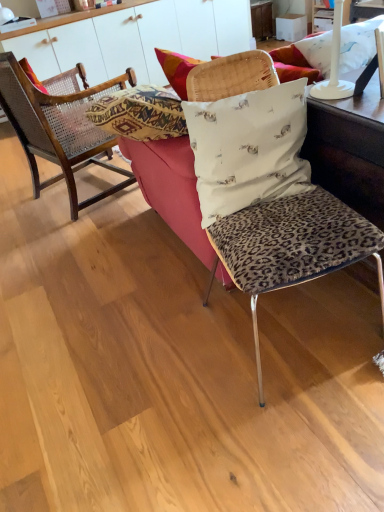
Locate an element on the screen. leopard print fabric couch at center is located at coordinates (347, 161).

This screenshot has height=512, width=384. What do you see at coordinates (139, 39) in the screenshot? I see `white glossy cabinet at upper center` at bounding box center [139, 39].

Locate an element on the screen. The width and height of the screenshot is (384, 512). wooden cane chair at left, positioned as the second chair in right-to-left order is located at coordinates (58, 129).

Looking at their sizes, would you say leopard print fabric couch at center is wider or thinner than leopard print cushion at center, acting as the 2th chair starting from the back?

leopard print fabric couch at center is wider than leopard print cushion at center, acting as the 2th chair starting from the back.

Based on their sizes in the image, would you say leopard print fabric couch at center is bigger or smaller than leopard print cushion at center, the second chair from the left?

Considering their sizes, leopard print fabric couch at center takes up more space than leopard print cushion at center, the second chair from the left.

Based on the photo, which of these two, leopard print fabric couch at center or leopard print cushion at center, acting as the 2th chair starting from the back, stands shorter?

With less height is leopard print fabric couch at center.

Does leopard print fabric couch at center lie behind leopard print cushion at center, the second chair from the left?

Yes, it is.

Would you say wooden cane chair at left, the first chair viewed from the back, is outside leopard print cushion at center, the 1th chair viewed from the right?

Yes.

Does point (103, 164) come in front of point (222, 248)?

No, (103, 164) is further to viewer.

Is wooden cane chair at left, the 1th chair in the left-to-right sequence, to the right of leopard print cushion at center, the second chair from the left, from the viewer's perspective?

Incorrect, wooden cane chair at left, the 1th chair in the left-to-right sequence, is not on the right side of leopard print cushion at center, the second chair from the left.

Is leopard print fabric couch at center oriented towards woven cane pillow at left, which is the 1th pillow in left-to-right order?

No, leopard print fabric couch at center does not turn towards woven cane pillow at left, which is the 1th pillow in left-to-right order.

Considering the relative sizes of leopard print fabric couch at center and woven cane pillow at left, which is the 1th pillow in left-to-right order, in the image provided, is leopard print fabric couch at center taller than woven cane pillow at left, which is the 1th pillow in left-to-right order,?

Correct, leopard print fabric couch at center is much taller as woven cane pillow at left, which is the 1th pillow in left-to-right order.

Is leopard print fabric couch at center bigger or smaller than woven cane pillow at left, the 2th pillow in the bottom-to-top sequence?

Considering their sizes, leopard print fabric couch at center takes up more space than woven cane pillow at left, the 2th pillow in the bottom-to-top sequence.

Does leopard print fabric couch at center appear on the right side of woven cane pillow at left, which is the first pillow in back-to-front order?

Yes.

Between white fabric pillow with small animal prints at center, the 2th pillow positioned from the back, and woven cane pillow at left, the 2th pillow in the bottom-to-top sequence, which one appears on the right side from the viewer's perspective?

white fabric pillow with small animal prints at center, the 2th pillow positioned from the back.

Is white fabric pillow with small animal prints at center, the first pillow when ordered from right to left, inside the boundaries of woven cane pillow at left, positioned as the 2th pillow in front-to-back order, or outside?

white fabric pillow with small animal prints at center, the first pillow when ordered from right to left, is outside woven cane pillow at left, positioned as the 2th pillow in front-to-back order.

How different are the orientations of white fabric pillow with small animal prints at center, which is counted as the first pillow, starting from the front, and woven cane pillow at left, which is the first pillow in back-to-front order, in degrees?

The angular difference between white fabric pillow with small animal prints at center, which is counted as the first pillow, starting from the front, and woven cane pillow at left, which is the first pillow in back-to-front order, is 119 degrees.

Does point (220, 138) come closer to viewer compared to point (74, 75)?

Yes, point (220, 138) is closer to viewer.

From a real-world perspective, which is physically below, white fabric pillow with small animal prints at center, the second pillow when ordered from left to right, or leopard print fabric couch at center?

leopard print fabric couch at center is physically lower.

From the picture: Is white fabric pillow with small animal prints at center, the second pillow when ordered from left to right, smaller than leopard print fabric couch at center?

Yes.

In terms of width, does white fabric pillow with small animal prints at center, the second pillow when ordered from left to right, look wider or thinner when compared to leopard print fabric couch at center?

white fabric pillow with small animal prints at center, the second pillow when ordered from left to right, is thinner than leopard print fabric couch at center.

Between wooden cane chair at left, the first chair viewed from the back, and white glossy cabinet at upper center, which one has smaller width?

Thinner between the two is white glossy cabinet at upper center.

Which is behind, wooden cane chair at left, the second chair when ordered from front to back, or white glossy cabinet at upper center?

Positioned behind is white glossy cabinet at upper center.

Does wooden cane chair at left, the first chair viewed from the back, appear on the right side of white glossy cabinet at upper center?

No, wooden cane chair at left, the first chair viewed from the back, is not to the right of white glossy cabinet at upper center.

Identify the location of dresser on the right of wooden cane chair at left, the first chair viewed from the back. (139, 39).

Is white glossy cabinet at upper center taller than leopard print cushion at center, the 1th chair positioned from the front?

No, white glossy cabinet at upper center is not taller than leopard print cushion at center, the 1th chair positioned from the front.

From the image's perspective, is white glossy cabinet at upper center under leopard print cushion at center, the 1th chair viewed from the right?

No, from the image's perspective, white glossy cabinet at upper center is not below leopard print cushion at center, the 1th chair viewed from the right.

Does white glossy cabinet at upper center turn towards leopard print cushion at center, the second chair from the left?

Yes, white glossy cabinet at upper center faces towards leopard print cushion at center, the second chair from the left.

Identify the location of chair that appears below the leopard print fabric couch at center (from the image's perspective). The height and width of the screenshot is (512, 384). (291, 247).

The image size is (384, 512). Identify the location of chair that appears in front of the wooden cane chair at left, the second chair when ordered from front to back. (291, 247).

Looking at the image, which one is located closer to white fabric pillow with small animal prints at center, marked as the 1th pillow in a bottom-to-top arrangement, white glossy cabinet at upper center or wooden cane chair at left, the 1th chair in the left-to-right sequence?

Among the two, wooden cane chair at left, the 1th chair in the left-to-right sequence, is located nearer to white fabric pillow with small animal prints at center, marked as the 1th pillow in a bottom-to-top arrangement.

Estimate the real-world distances between objects in this image. Which object is further from woven cane pillow at left, the 2th pillow in the bottom-to-top sequence, white glossy cabinet at upper center or leopard print fabric couch at center?

Based on the image, white glossy cabinet at upper center appears to be further to woven cane pillow at left, the 2th pillow in the bottom-to-top sequence.

When comparing their distances from wooden cane chair at left, the first chair viewed from the back, does leopard print fabric couch at center or white fabric pillow with small animal prints at center, which is counted as the first pillow, starting from the front, seem further?

The object further to wooden cane chair at left, the first chair viewed from the back, is white fabric pillow with small animal prints at center, which is counted as the first pillow, starting from the front.

Considering their positions, is white glossy cabinet at upper center positioned closer to woven cane pillow at left, which is the 1th pillow in left-to-right order, than white fabric pillow with small animal prints at center, the second pillow in the top-to-bottom sequence?

The object closer to woven cane pillow at left, which is the 1th pillow in left-to-right order, is white glossy cabinet at upper center.

Considering their positions, is white fabric pillow with small animal prints at center, which is counted as the first pillow, starting from the front, positioned further to leopard print cushion at center, acting as the 2th chair starting from the back, than woven cane pillow at left, the 2th pillow in the bottom-to-top sequence?

The object further to leopard print cushion at center, acting as the 2th chair starting from the back, is woven cane pillow at left, the 2th pillow in the bottom-to-top sequence.

From the image, which object appears to be nearer to woven cane pillow at left, positioned as the 2th pillow in front-to-back order, white glossy cabinet at upper center or wooden cane chair at left, the first chair viewed from the back?

The object closer to woven cane pillow at left, positioned as the 2th pillow in front-to-back order, is wooden cane chair at left, the first chair viewed from the back.

Which object lies further to the anchor point leopard print cushion at center, the 1th chair viewed from the right, white glossy cabinet at upper center or leopard print fabric couch at center?

white glossy cabinet at upper center is further to leopard print cushion at center, the 1th chair viewed from the right.

Based on the photo, considering their positions, is wooden cane chair at left, the first chair viewed from the back, positioned further to white fabric pillow with small animal prints at center, the 2th pillow positioned from the back, than leopard print cushion at center, the 1th chair positioned from the front?

Among the two, wooden cane chair at left, the first chair viewed from the back, is located further to white fabric pillow with small animal prints at center, the 2th pillow positioned from the back.

What are the coordinates of `chair between white fabric pillow with small animal prints at center, the 2th pillow positioned from the back, and white glossy cabinet at upper center, along the z-axis` in the screenshot? It's located at (58, 129).

The height and width of the screenshot is (512, 384). Find the location of `pillow between leopard print cushion at center, the 1th chair viewed from the right, and wooden cane chair at left, positioned as the second chair in right-to-left order, from front to back`. pillow between leopard print cushion at center, the 1th chair viewed from the right, and wooden cane chair at left, positioned as the second chair in right-to-left order, from front to back is located at coordinates (248, 148).

Identify the location of pillow located between leopard print fabric couch at center and white glossy cabinet at upper center in the depth direction. Image resolution: width=384 pixels, height=512 pixels. (57, 80).

At what (x,y) coordinates should I click in order to perform the action: click on chair between wooden cane chair at left, the first chair viewed from the back, and leopard print fabric couch at center, in the horizontal direction. Please return your answer as a coordinate pair (x, y). Image resolution: width=384 pixels, height=512 pixels. Looking at the image, I should click on (291, 247).